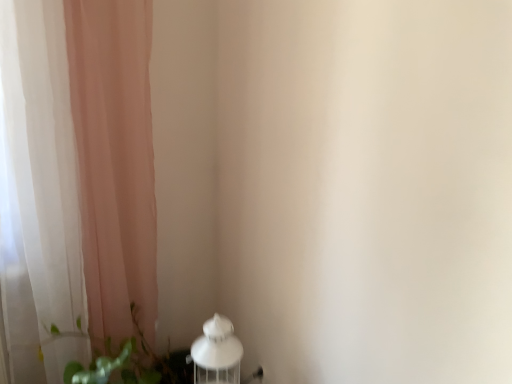
The height and width of the screenshot is (384, 512). What are the coordinates of `green leafy plant at lower left` in the screenshot? It's located at (132, 363).

Describe the element at coordinates (217, 353) in the screenshot. I see `white matte table lamp at lower left` at that location.

In order to face sheer pink curtain at left, should I rotate leftwards or rightwards?

Answer: To face it directly, rotate left by 21.723 degrees.

Image resolution: width=512 pixels, height=384 pixels. I want to click on green leafy plant at lower left, so click(x=132, y=363).

Considering the positions of objects green leafy plant at lower left and sheer pink curtain at left in the image provided, who is more to the left, green leafy plant at lower left or sheer pink curtain at left?

From the viewer's perspective, sheer pink curtain at left appears more on the left side.

Who is bigger, green leafy plant at lower left or sheer pink curtain at left?

sheer pink curtain at left is bigger.

Is point (158, 380) closer or farther from the camera than point (42, 40)?

Point (158, 380) is farther from the camera than point (42, 40).

Is sheer pink curtain at left not close to green leafy plant at lower left?

No.

What's the angular difference between sheer pink curtain at left and green leafy plant at lower left's facing directions?

They differ by 0.000742 degrees in their facing directions.

Is sheer pink curtain at left taller or shorter than green leafy plant at lower left?

sheer pink curtain at left is taller than green leafy plant at lower left.

Considering the positions of objects white matte table lamp at lower left and green leafy plant at lower left in the image provided, who is behind, white matte table lamp at lower left or green leafy plant at lower left?

white matte table lamp at lower left is more distant.

Considering the sizes of objects white matte table lamp at lower left and green leafy plant at lower left in the image provided, who is wider, white matte table lamp at lower left or green leafy plant at lower left?

green leafy plant at lower left.

Which is more to the left, white matte table lamp at lower left or green leafy plant at lower left?

green leafy plant at lower left is more to the left.

Which is closer to the camera, (140,337) or (230,331)?

The point (230,331) is closer.

Considering the sizes of green leafy plant at lower left and white matte table lamp at lower left in the image, is green leafy plant at lower left bigger or smaller than white matte table lamp at lower left?

Considering their sizes, green leafy plant at lower left takes up more space than white matte table lamp at lower left.

From the image's perspective, is green leafy plant at lower left located above or below white matte table lamp at lower left?

Based on their image positions, green leafy plant at lower left is located beneath white matte table lamp at lower left.

Does white matte table lamp at lower left turn towards sheer pink curtain at left?

No, white matte table lamp at lower left is not facing towards sheer pink curtain at left.

Does white matte table lamp at lower left have a lesser height compared to sheer pink curtain at left?

Correct, white matte table lamp at lower left is not as tall as sheer pink curtain at left.

Can you confirm if white matte table lamp at lower left is bigger than sheer pink curtain at left?

No, white matte table lamp at lower left is not bigger than sheer pink curtain at left.

Which is less distant, (205, 328) or (0, 7)?

Point (205, 328) is farther from the camera than point (0, 7).

How far apart are sheer pink curtain at left and white matte table lamp at lower left?

They are 58.97 centimeters apart.

Could you tell me if sheer pink curtain at left is facing white matte table lamp at lower left?

Yes, sheer pink curtain at left is facing white matte table lamp at lower left.

Based on the photo, from the image's perspective, is sheer pink curtain at left located above or below white matte table lamp at lower left?

Clearly, from the image's perspective, sheer pink curtain at left is above white matte table lamp at lower left.

Between sheer pink curtain at left and white matte table lamp at lower left, which one appears on the right side from the viewer's perspective?

Positioned to the right is white matte table lamp at lower left.

Locate an element on the screen. curtain lying on the left of green leafy plant at lower left is located at coordinates (75, 179).

At what (x,y) coordinates should I click in order to perform the action: click on curtain above the green leafy plant at lower left (from the image's perspective). Please return your answer as a coordinate pair (x, y). This screenshot has height=384, width=512. Looking at the image, I should click on (75, 179).

Estimate the real-world distances between objects in this image. Which object is closer to sheer pink curtain at left, white matte table lamp at lower left or green leafy plant at lower left?

The object closer to sheer pink curtain at left is green leafy plant at lower left.

Estimate the real-world distances between objects in this image. Which object is further from white matte table lamp at lower left, green leafy plant at lower left or sheer pink curtain at left?

sheer pink curtain at left is further to white matte table lamp at lower left.

Based on their spatial positions, is sheer pink curtain at left or white matte table lamp at lower left further from green leafy plant at lower left?

sheer pink curtain at left lies further to green leafy plant at lower left than the other object.

Estimate the real-world distances between objects in this image. Which object is further from sheer pink curtain at left, green leafy plant at lower left or white matte table lamp at lower left?

Among the two, white matte table lamp at lower left is located further to sheer pink curtain at left.

From the picture: Estimate the real-world distances between objects in this image. Which object is closer to green leafy plant at lower left, white matte table lamp at lower left or sheer pink curtain at left?

The object closer to green leafy plant at lower left is white matte table lamp at lower left.

Which object lies further to the anchor point white matte table lamp at lower left, sheer pink curtain at left or green leafy plant at lower left?

The object further to white matte table lamp at lower left is sheer pink curtain at left.

Where is `table lamp between sheer pink curtain at left and green leafy plant at lower left from top to bottom`? This screenshot has height=384, width=512. table lamp between sheer pink curtain at left and green leafy plant at lower left from top to bottom is located at coordinates (217, 353).